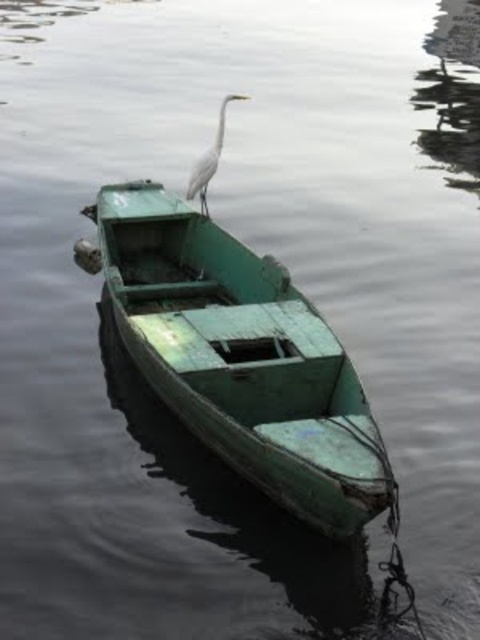
Measure the distance between point (x=250, y=369) and camera.

The distance of point (x=250, y=369) from camera is 9.20 meters.

Is the position of green weathered wood boat at center less distant than that of white matte bird at upper center?

Yes, green weathered wood boat at center is closer to the viewer.

Where is `green weathered wood boat at center`? This screenshot has width=480, height=640. green weathered wood boat at center is located at coordinates (240, 356).

Where is `green weathered wood boat at center`? Image resolution: width=480 pixels, height=640 pixels. green weathered wood boat at center is located at coordinates (240, 356).